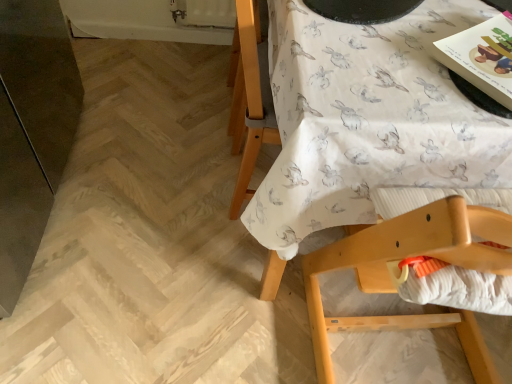
The height and width of the screenshot is (384, 512). What are the coordinates of `white textured fabric at lower right` in the screenshot? It's located at (460, 290).

What do you see at coordinates (460, 290) in the screenshot? I see `white textured fabric at lower right` at bounding box center [460, 290].

What do you see at coordinates (482, 56) in the screenshot?
I see `matte paper magazine at upper right` at bounding box center [482, 56].

Locate an element on the screen. The height and width of the screenshot is (384, 512). white textured fabric at lower right is located at coordinates (460, 290).

Does white textured fabric at lower right have a greater width compared to wooden highchair at upper right?

Incorrect, the width of white textured fabric at lower right does not surpass that of wooden highchair at upper right.

Which object is closer to the camera taking this photo, white textured fabric at lower right or wooden highchair at upper right?

wooden highchair at upper right is in front.

The height and width of the screenshot is (384, 512). Identify the location of sheet that appears above the wooden highchair at upper right (from a real-world perspective). (460, 290).

From a real-world perspective, is white textured fabric at lower right above or below wooden highchair at upper right?

white textured fabric at lower right is above wooden highchair at upper right.

Is matte paper magazine at upper right to the left or to the right of wooden highchair at upper right in the image?

matte paper magazine at upper right is to the right of wooden highchair at upper right.

Considering the relative sizes of matte paper magazine at upper right and wooden highchair at upper right in the image provided, is matte paper magazine at upper right shorter than wooden highchair at upper right?

Yes, matte paper magazine at upper right is shorter than wooden highchair at upper right.

Is matte paper magazine at upper right positioned far away from wooden highchair at upper right?

matte paper magazine at upper right is actually quite close to wooden highchair at upper right.

Can you tell me how much matte paper magazine at upper right and wooden highchair at upper right differ in facing direction?

The angle between the facing direction of matte paper magazine at upper right and the facing direction of wooden highchair at upper right is 146 degrees.

Is matte paper magazine at upper right at the left side of white textured fabric at lower right?

In fact, matte paper magazine at upper right is to the right of white textured fabric at lower right.

Could white textured fabric at lower right be considered to be inside matte paper magazine at upper right?

No, white textured fabric at lower right is located outside of matte paper magazine at upper right.

Can you confirm if matte paper magazine at upper right is wider than white textured fabric at lower right?

Incorrect, the width of matte paper magazine at upper right does not surpass that of white textured fabric at lower right.

Which of these two, matte paper magazine at upper right or white textured fabric at lower right, stands shorter?

matte paper magazine at upper right is shorter.

Is wooden highchair at upper right wider or thinner than matte paper magazine at upper right?

In the image, wooden highchair at upper right appears to be wider than matte paper magazine at upper right.

Are wooden highchair at upper right and matte paper magazine at upper right far apart?

No, there isn't a large distance between wooden highchair at upper right and matte paper magazine at upper right.

Is wooden highchair at upper right taller than matte paper magazine at upper right?

Indeed, wooden highchair at upper right has a greater height compared to matte paper magazine at upper right.

Can we say wooden highchair at upper right lies outside matte paper magazine at upper right?

Absolutely, wooden highchair at upper right is external to matte paper magazine at upper right.

Considering the positions of objects white textured fabric at lower right and white fabric with rabbit print at upper right in the image provided, who is behind, white textured fabric at lower right or white fabric with rabbit print at upper right?

Positioned behind is white fabric with rabbit print at upper right.

Could you tell me if white textured fabric at lower right is facing white fabric with rabbit print at upper right?

Yes.

Between white textured fabric at lower right and white fabric with rabbit print at upper right, which one has smaller size?

Smaller between the two is white textured fabric at lower right.

From the image's perspective, is white textured fabric at lower right located above or below white fabric with rabbit print at upper right?

white textured fabric at lower right is situated lower than white fabric with rabbit print at upper right in the image.

Which of these two, matte paper magazine at upper right or white fabric with rabbit print at upper right, is wider?

Wider between the two is white fabric with rabbit print at upper right.

In the image, is matte paper magazine at upper right on the left side or the right side of white fabric with rabbit print at upper right?

matte paper magazine at upper right is positioned on white fabric with rabbit print at upper right's right side.

From a real-world perspective, is matte paper magazine at upper right positioned over white fabric with rabbit print at upper right based on gravity?

Indeed, from a real-world perspective, matte paper magazine at upper right stands above white fabric with rabbit print at upper right.

Is white fabric with rabbit print at upper right completely or partially inside matte paper magazine at upper right?

No, white fabric with rabbit print at upper right is not a part of matte paper magazine at upper right.

Can you confirm if wooden highchair at upper right is shorter than white fabric with rabbit print at upper right?

No.

Would you say wooden highchair at upper right is outside white fabric with rabbit print at upper right?

No, wooden highchair at upper right is not outside of white fabric with rabbit print at upper right.

Considering the positions of points (462, 205) and (301, 245), is point (462, 205) closer to camera compared to point (301, 245)?

That is True.

Identify the location of chair below the white fabric with rabbit print at upper right (from the image's perspective). (408, 257).

The image size is (512, 384). Find the location of `chair lying in front of the white textured fabric at lower right`. chair lying in front of the white textured fabric at lower right is located at coordinates (408, 257).

The image size is (512, 384). I want to click on chair below the matte paper magazine at upper right (from a real-world perspective), so click(x=408, y=257).

Estimate the real-world distances between objects in this image. Which object is closer to matte paper magazine at upper right, white fabric with rabbit print at upper right or wooden highchair at upper right?

Based on the image, white fabric with rabbit print at upper right appears to be nearer to matte paper magazine at upper right.

From the image, which object appears to be nearer to wooden highchair at upper right, white textured fabric at lower right or matte paper magazine at upper right?

The object closer to wooden highchair at upper right is white textured fabric at lower right.

From the image, which object appears to be nearer to white textured fabric at lower right, white fabric with rabbit print at upper right or wooden highchair at upper right?

wooden highchair at upper right is closer to white textured fabric at lower right.

Which object lies nearer to the anchor point matte paper magazine at upper right, wooden highchair at upper right or white textured fabric at lower right?

white textured fabric at lower right is positioned closer to the anchor matte paper magazine at upper right.

When comparing their distances from wooden highchair at upper right, does white textured fabric at lower right or white fabric with rabbit print at upper right seem further?

white fabric with rabbit print at upper right is positioned further to the anchor wooden highchair at upper right.

Which object lies nearer to the anchor point white fabric with rabbit print at upper right, matte paper magazine at upper right or white textured fabric at lower right?

The object closer to white fabric with rabbit print at upper right is white textured fabric at lower right.

From the image, which object appears to be nearer to white fabric with rabbit print at upper right, white textured fabric at lower right or wooden highchair at upper right?

Based on the image, white textured fabric at lower right appears to be nearer to white fabric with rabbit print at upper right.

Considering their positions, is wooden highchair at upper right positioned further to white textured fabric at lower right than matte paper magazine at upper right?

The object further to white textured fabric at lower right is matte paper magazine at upper right.

At what (x,y) coordinates should I click in order to perform the action: click on magazine between white fabric with rabbit print at upper right and wooden highchair at upper right from top to bottom. Please return your answer as a coordinate pair (x, y). This screenshot has height=384, width=512. Looking at the image, I should click on (482, 56).

The width and height of the screenshot is (512, 384). I want to click on magazine between white fabric with rabbit print at upper right and white textured fabric at lower right in the vertical direction, so click(x=482, y=56).

Image resolution: width=512 pixels, height=384 pixels. I want to click on sheet between white fabric with rabbit print at upper right and wooden highchair at upper right from top to bottom, so click(x=460, y=290).

Image resolution: width=512 pixels, height=384 pixels. What are the coordinates of `sheet between matte paper magazine at upper right and wooden highchair at upper right in the up-down direction` in the screenshot? It's located at (460, 290).